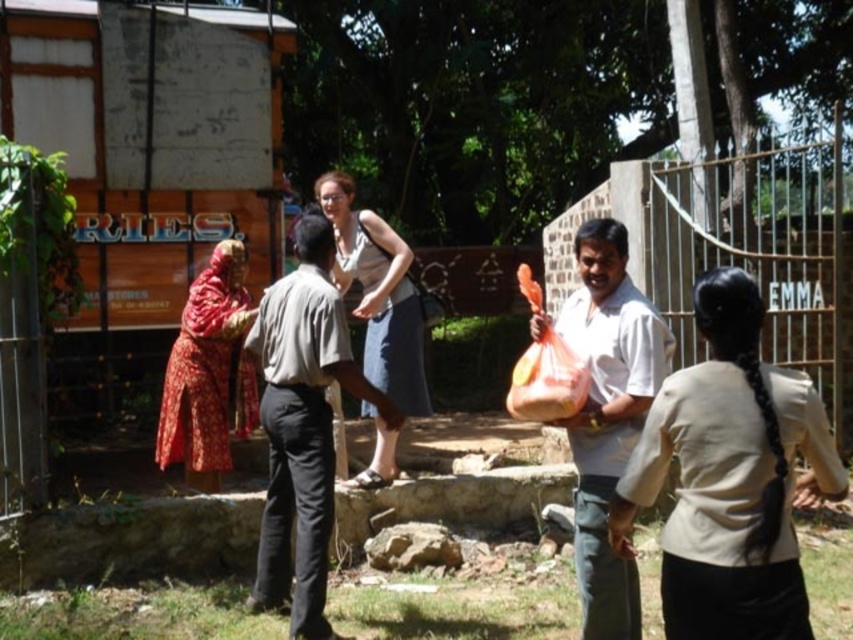
You are a delivery person who needs to hand over a package to the recipient. You see the light brown cotton shirt at center and the translucent orange bag at right in the scene. Which object should you approach first to ensure proper delivery?

The light brown cotton shirt at center should be approached first since it is positioned to the left of the translucent orange bag at right, indicating the recipient is likely standing there.

You are a delivery person standing at the gate and see two people in the scene. The beige fabric shirt at center and the light brown cotton shirt at center. Which one is positioned to the right of the other?

The beige fabric shirt at center is to the right of the light brown cotton shirt at center according to the description.

You are a delivery person standing at the scene described. You need to hand a package to the person wearing the beige fabric shirt at center and the light brown cotton shirt at center. Which one is higher up in the image?

The beige fabric shirt at center is above the light brown cotton shirt at center, so you should hand the package to the beige fabric shirt at center as it is higher up.